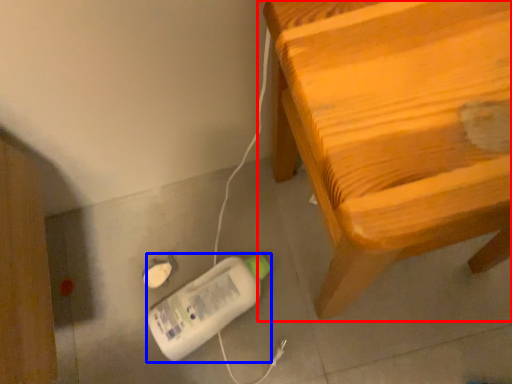
Question: Which object appears farthest to the camera in this image, furniture (highlighted by a red box) or equipment (highlighted by a blue box)?

Choices:
 (A) furniture
 (B) equipment

Answer: (B)